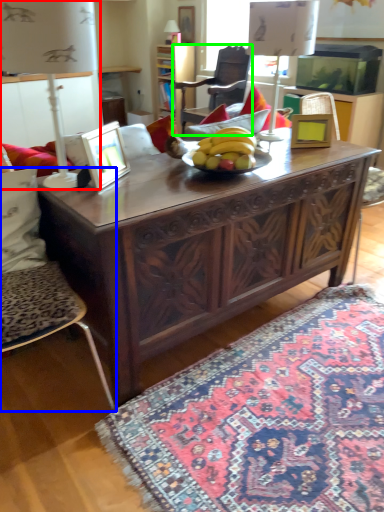
Question: Which object is the farthest from lamp (highlighted by a red box)? Choose among these: chair (highlighted by a blue box) or chair (highlighted by a green box).

Choices:
 (A) chair
 (B) chair

Answer: (B)